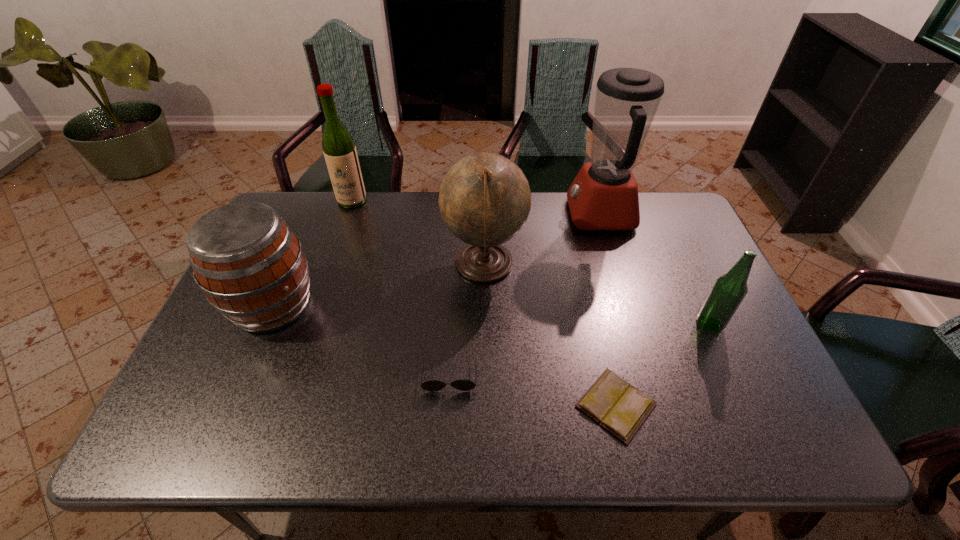
Find the location of a particular element. The image size is (960, 540). vacant space located 0.250m on the label of the liquor is located at coordinates (332, 261).

Locate an element on the screen. The image size is (960, 540). vacant area situated on the front-facing side of the globe is located at coordinates (327, 265).

Find the location of a particular element. This screenshot has height=540, width=960. vacant space situated on the front-facing side of the globe is located at coordinates (406, 265).

Locate an element on the screen. vacant space located on the front-facing side of the globe is located at coordinates (330, 265).

Locate an element on the screen. The image size is (960, 540). vacant region located on the back of the cider is located at coordinates (292, 260).

Where is `free location located 0.130m on the label of the rightmost object`? This screenshot has height=540, width=960. free location located 0.130m on the label of the rightmost object is located at coordinates (646, 324).

Identify the location of vacant region located on the label of the rightmost object. The height and width of the screenshot is (540, 960). (626, 324).

Where is `vacant space located 0.230m on the label of the rightmost object`? The height and width of the screenshot is (540, 960). vacant space located 0.230m on the label of the rightmost object is located at coordinates (607, 324).

Image resolution: width=960 pixels, height=540 pixels. Identify the location of free space located on the front-facing side of the second shortest object. (447, 413).

The width and height of the screenshot is (960, 540). I want to click on free spot located 0.380m on the back of the diary, so click(582, 259).